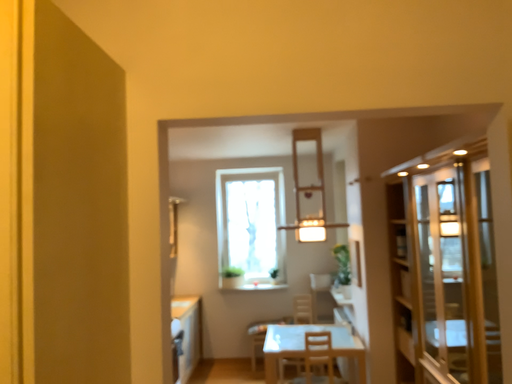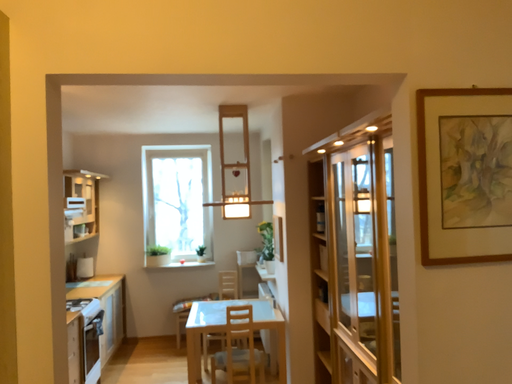
Question: Which way did the camera rotate in the video?

Choices:
 (A) rotated left
 (B) rotated right

Answer: (B)